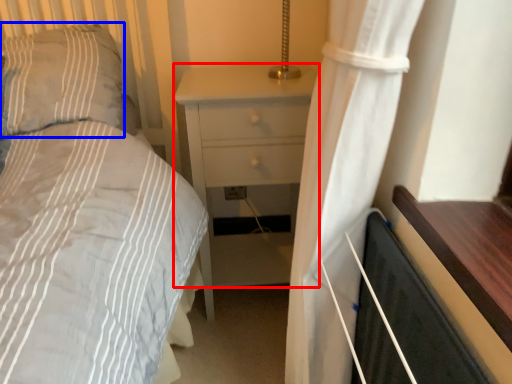
Question: Among these objects, which one is nearest to the camera, nightstand (highlighted by a red box) or pillow (highlighted by a blue box)?

Choices:
 (A) nightstand
 (B) pillow

Answer: (B)